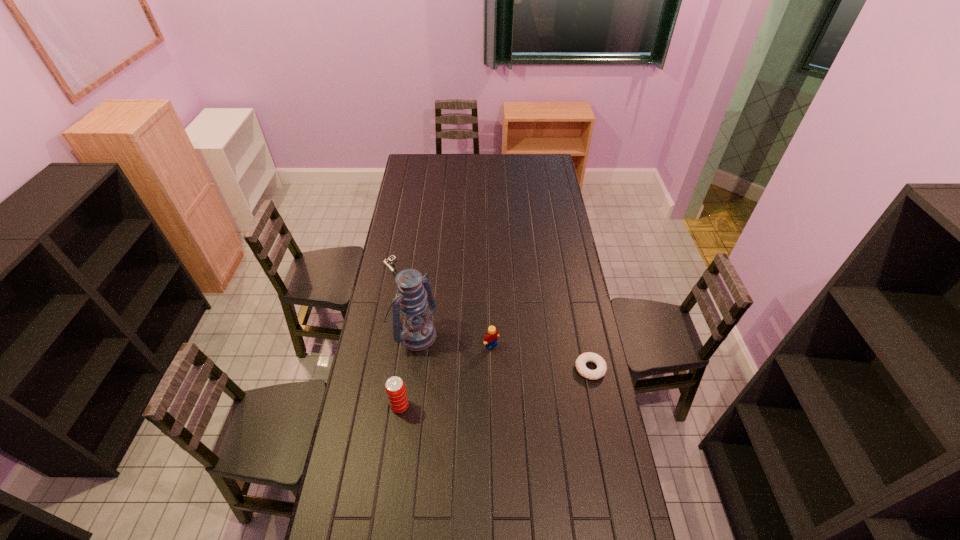
The width and height of the screenshot is (960, 540). Identify the location of vacant space on the desktop that is between the second tallest object and the second nearest object and is positioned on the front-facing side of the lantern. (490, 388).

Identify the location of free spot on the desktop that is between the second tallest object and the second shortest object and is positioned on the front-facing side of the farthest object. (502, 386).

Image resolution: width=960 pixels, height=540 pixels. Identify the location of vacant space on the desktop that is between the nearest object and the fourth farthest object and is positioned on the front-facing side of the third tallest object. (524, 382).